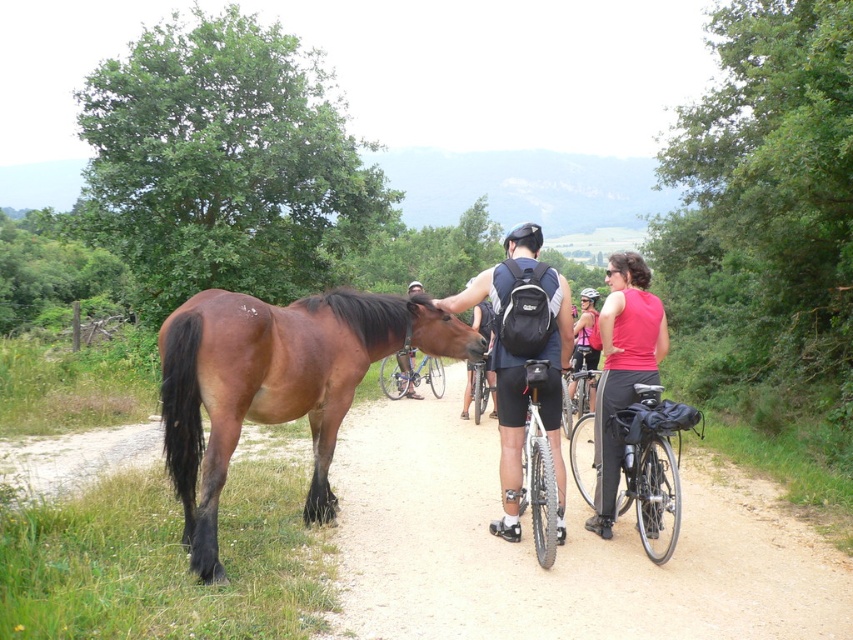
Question: Is brown leather bicycle at center to the left of brown glossy horse at left from the viewer's perspective?

Choices:
 (A) no
 (B) yes

Answer: (A)

Question: Observing the image, what is the correct spatial positioning of matte black backpack at center in reference to silver metallic bicycle at center?

Choices:
 (A) left
 (B) right

Answer: (B)

Question: Which is nearer to the silver metallic bicycle at center?

Choices:
 (A) black matte bicycle helmet at center
 (B) brown glossy horse at left
 (C) matte pink shirt at right
 (D) blue metallic bicycle at center

Answer: (D)

Question: Is blue metallic bicycle at center smaller than silver metallic bicycle at center?

Choices:
 (A) yes
 (B) no

Answer: (B)

Question: Estimate the real-world distances between objects in this image. Which object is closer to the matte pink shirt at right?

Choices:
 (A) black matte bicycle helmet at center
 (B) silver metallic bicycle at center

Answer: (B)

Question: Which object appears farthest from the camera in this image?

Choices:
 (A) brown leather bicycle at center
 (B) black matte bicycle helmet at upper center
 (C) blue metallic bicycle at center
 (D) black matte bicycle helmet at center

Answer: (C)